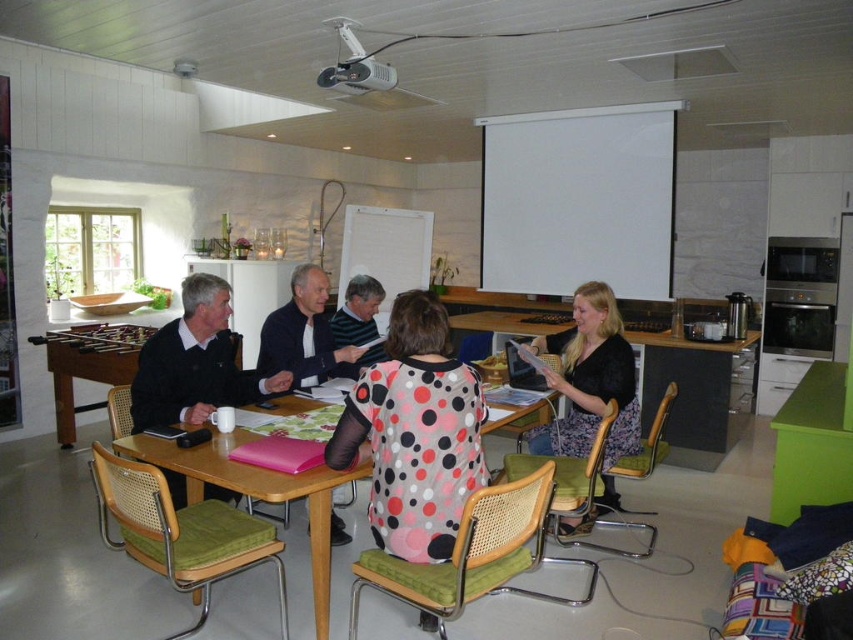
You are a photographer trying to capture a group photo of the dark blue sweater at center and the polka dot fabric shirt at center. The camera you are using has a minimum focus distance of 6 inches. Can you take a photo of both subjects without moving either of them?

The distance between the dark blue sweater at center and the polka dot fabric shirt at center is 6.74 inches, which is greater than the camera minimum focus distance of 6 inches. Therefore, you can take a photo of both subjects without moving them.